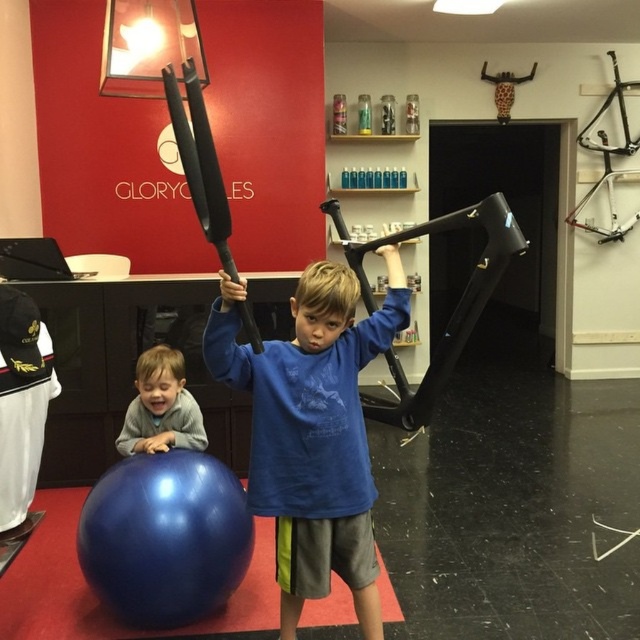
Question: Is blue matte shirt at center to the right of gray fleece sweater at lower left from the viewer's perspective?

Choices:
 (A) yes
 (B) no

Answer: (A)

Question: Among these objects, which one is farthest from the camera?

Choices:
 (A) blue matte shirt at center
 (B) blue rubber ball at lower left
 (C) gray fleece sweater at lower left

Answer: (C)

Question: Which point is farther from the camera taking this photo?

Choices:
 (A) (188, 435)
 (B) (298, 404)
 (C) (84, 605)

Answer: (A)

Question: Can you confirm if blue matte shirt at center is bigger than gray fleece sweater at lower left?

Choices:
 (A) yes
 (B) no

Answer: (A)

Question: Does blue matte shirt at center lie in front of gray fleece sweater at lower left?

Choices:
 (A) yes
 (B) no

Answer: (A)

Question: Among these points, which one is nearest to the camera?

Choices:
 (A) (3, 589)
 (B) (339, 307)
 (C) (173, 403)

Answer: (B)